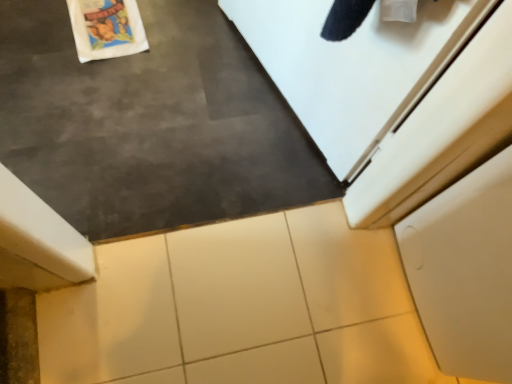
Question: From a real-world perspective, is white matte cabinet at lower right physically located above or below white tile at center?

Choices:
 (A) above
 (B) below

Answer: (A)

Question: Looking at their shapes, would you say white matte cabinet at lower right is wider or thinner than white tile at center?

Choices:
 (A) wide
 (B) thin

Answer: (A)

Question: Which is nearer to the slate at center?

Choices:
 (A) white matte cabinet at lower right
 (B) white glossy tile at center
 (C) white tile at center

Answer: (C)

Question: Which is farther from the white glossy tile at center?

Choices:
 (A) white tile at center
 (B) white matte cabinet at lower right
 (C) slate at center

Answer: (B)